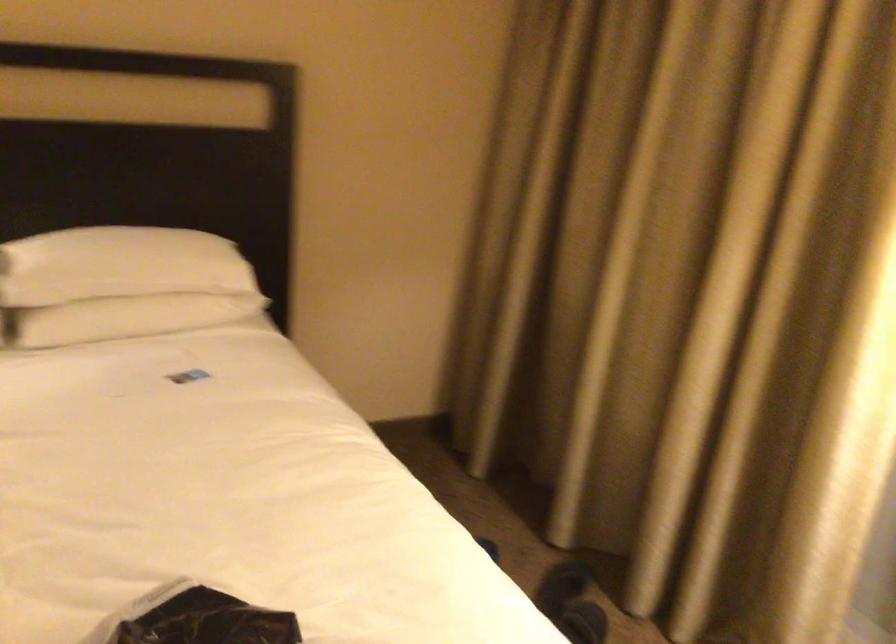
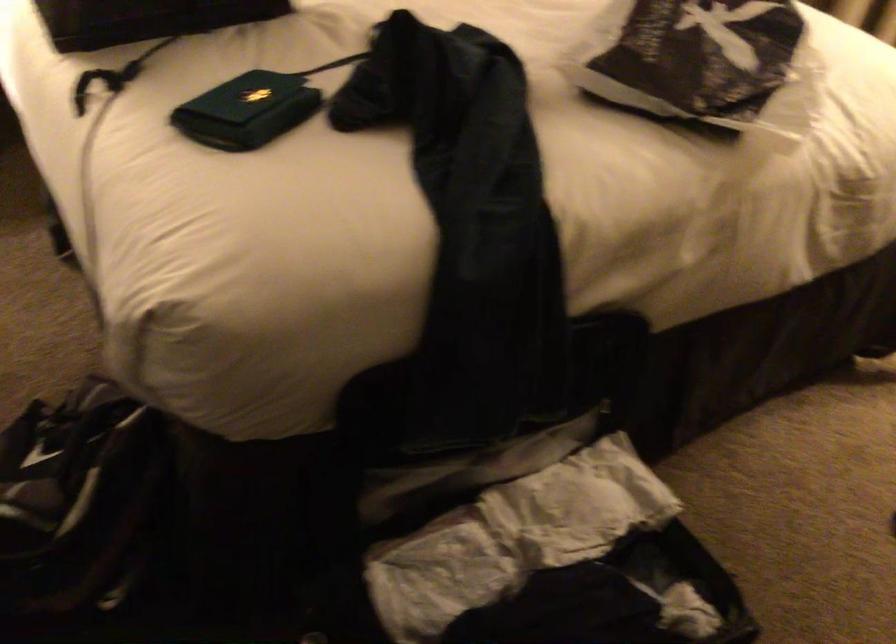
Which direction would the cameraman need to move to produce the second image?

The movement direction of the cameraman is left, backward.